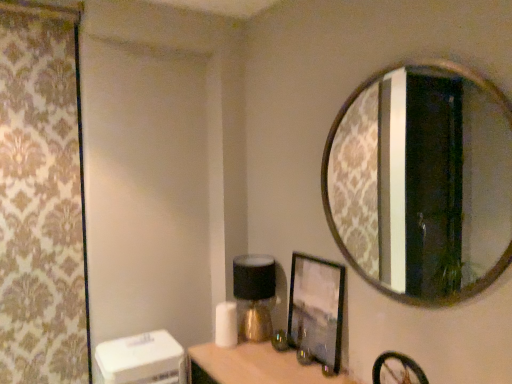
Question: Considering their positions, is matte gold table lamp at center located in front of or behind gold-framed mirror at upper right?

Choices:
 (A) behind
 (B) front

Answer: (A)

Question: Which is correct: matte gold table lamp at center is inside gold-framed mirror at upper right, or outside of it?

Choices:
 (A) outside
 (B) inside

Answer: (A)

Question: Which object is positioned farthest from the matte gold table lamp at center?

Choices:
 (A) gold-framed mirror at upper right
 (B) matte black picture frame at center
 (C) patterned fabric curtain at left

Answer: (A)

Question: Which of these objects is positioned closest to the matte black picture frame at center?

Choices:
 (A) gold-framed mirror at upper right
 (B) patterned fabric curtain at left
 (C) matte gold table lamp at center

Answer: (C)